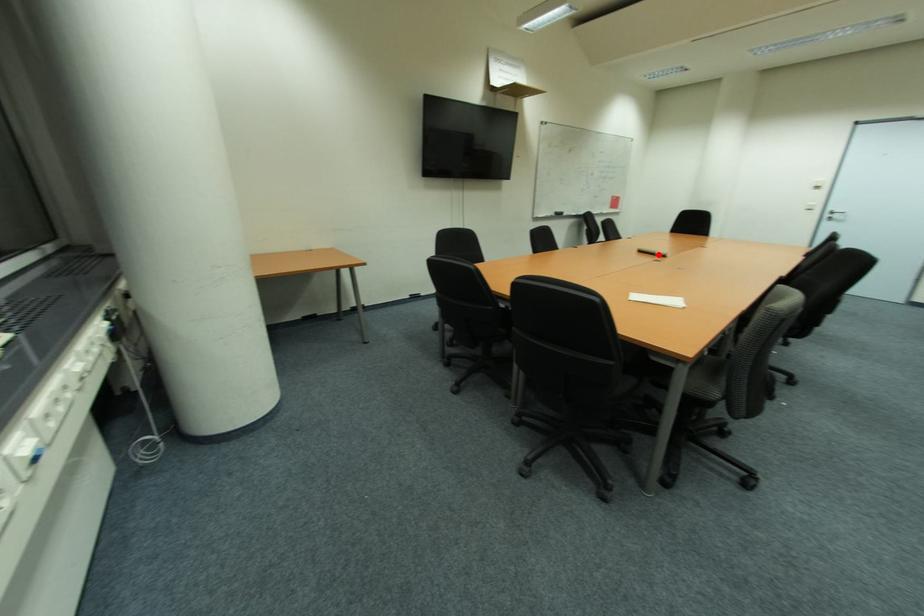
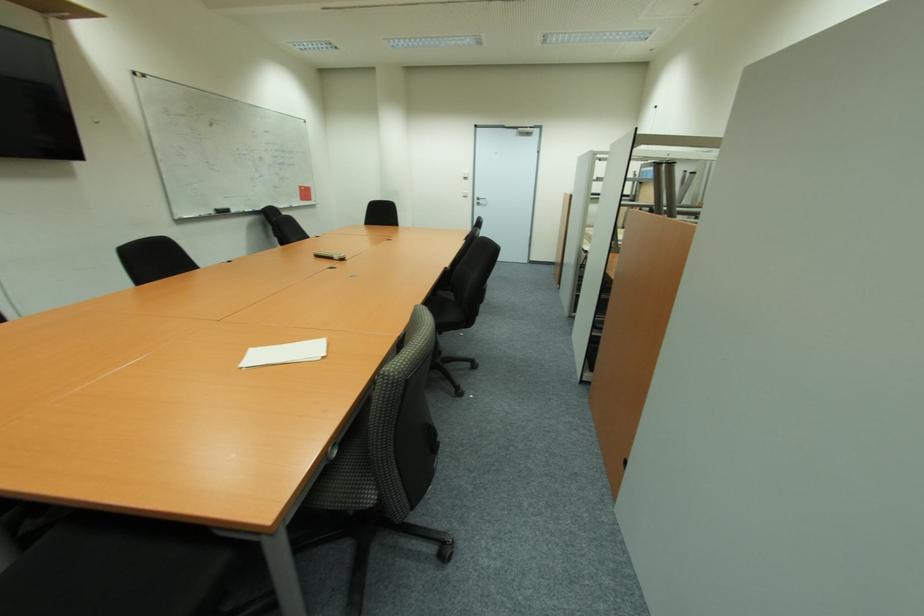
Where in the second image is the point corresponding to the highlighted location from the first image?

(334, 259)